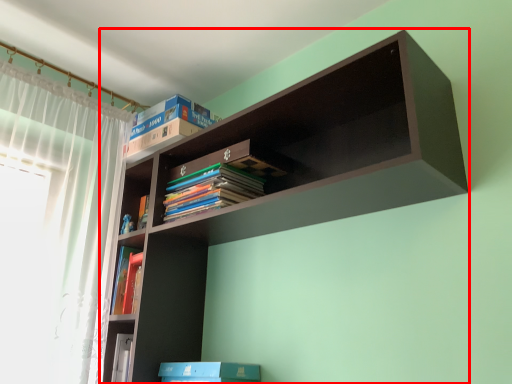
Question: Observing the image, what is the correct spatial positioning of shelf (annotated by the red box) in reference to book?

Choices:
 (A) left
 (B) right

Answer: (B)